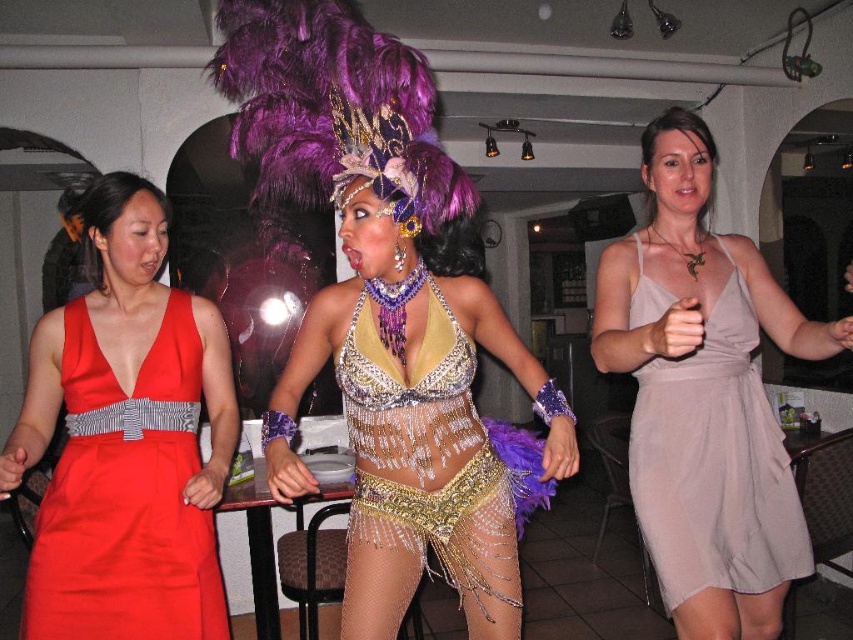
You are a photographer standing at the center of the room. You want to take a photo of the two points in the image. Which point is closer to your camera? The two points are point (645, 404) and point (363, 481).

Point (363, 481) is closer to the camera than point (645, 404).

You are a photographer at a festival. You need to capture a photo of the shiny metallic costume at center and the shiny metallic belly dancer costume at center. The festival requires that the dancer on the right must be placed to the left side of the other dancer in the photo. Is this possible given their current positions?

The shiny metallic costume at center is positioned on the right side of the shiny metallic belly dancer costume at center. Therefore, to meet the festival requirement, the photographer would need to adjust their positions because currently the shiny metallic costume at center is already on the right of the shiny metallic belly dancer costume at center, so if the requirement is to have the dancer on the right placed to the left, it is not possible without moving them.

You are a photographer trying to capture the perfect shot of the festive scene. You notice a point at coordinates (704, 396) in the image. Which object from the scene does this point correspond to?

The point at coordinates (704, 396) corresponds to the matte beige dress at center.